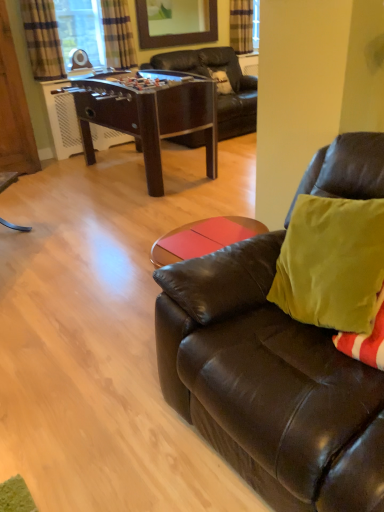
Question: Relative to wooden frame mirror at upper center, is brown wooden foosball table at center in front or behind?

Choices:
 (A) behind
 (B) front

Answer: (B)

Question: Is point (208, 119) positioned closer to the camera than point (215, 10)?

Choices:
 (A) closer
 (B) farther

Answer: (A)

Question: Considering the real-world distances, which object is farthest from the wooden armoire at left?

Choices:
 (A) wooden frame mirror at upper center
 (B) plaid fabric curtain at upper center, which is counted as the third curtain, starting from the left
 (C) matte brown leather couch at right
 (D) brown wooden foosball table at center
 (E) plaid fabric curtain at upper left, which is the 2th curtain in left-to-right order

Answer: (C)

Question: Which object is positioned closest to the plaid fabric curtain at upper left, placed as the first curtain when sorted from front to back?

Choices:
 (A) wooden armoire at left
 (B) brown wooden foosball table at center
 (C) matte brown leather couch at right
 (D) plaid fabric curtain at upper left, which is the 2th curtain in left-to-right order
 (E) wooden frame mirror at upper center

Answer: (A)